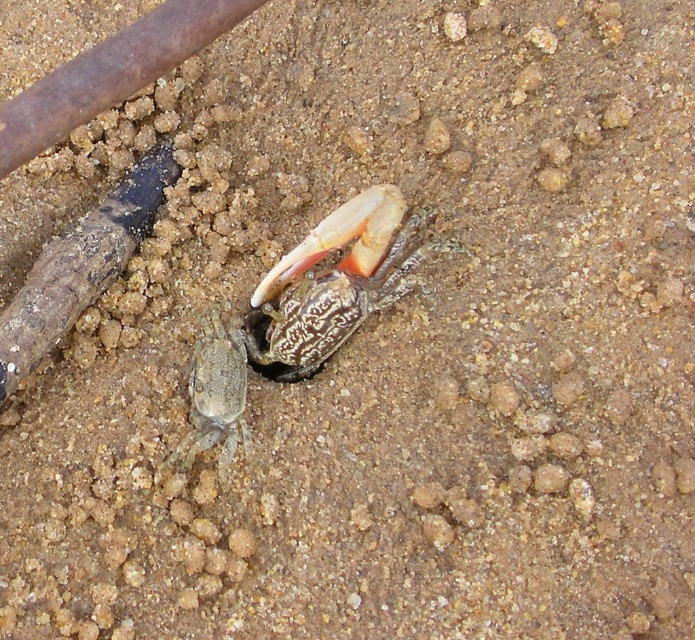
Question: Which point is closer to the camera taking this photo?

Choices:
 (A) [320, 234]
 (B) [224, 381]

Answer: (A)

Question: Is shiny metallic crab at center to the left of gray matte crab at lower left from the viewer's perspective?

Choices:
 (A) no
 (B) yes

Answer: (A)

Question: Which point is farther from the camera taking this photo?

Choices:
 (A) (222, 332)
 (B) (379, 275)

Answer: (A)

Question: Can you confirm if shiny metallic crab at center is positioned to the left of gray matte crab at lower left?

Choices:
 (A) no
 (B) yes

Answer: (A)

Question: Does shiny metallic crab at center have a smaller size compared to gray matte crab at lower left?

Choices:
 (A) yes
 (B) no

Answer: (B)